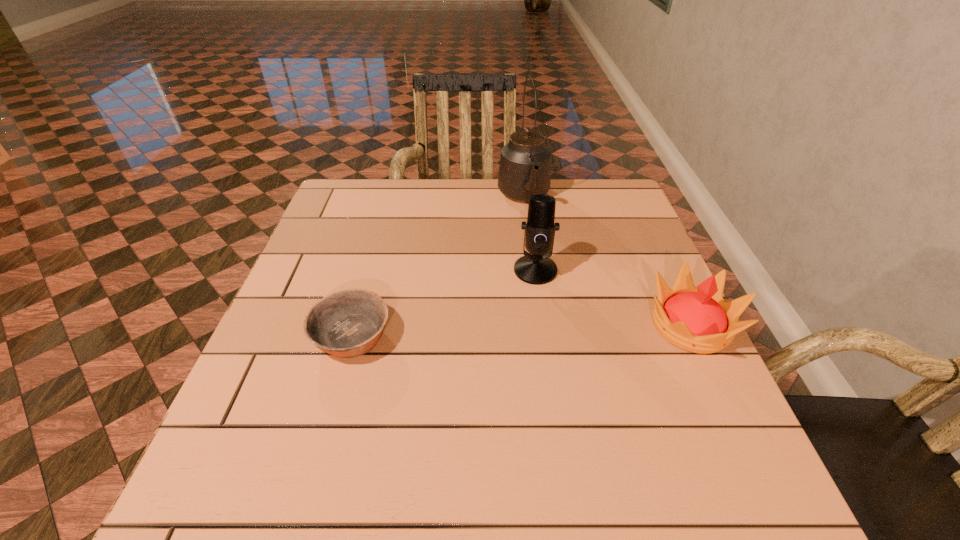
This screenshot has width=960, height=540. I want to click on free spot between the bowl and the crown, so click(x=521, y=330).

At what (x,y) coordinates should I click in order to perform the action: click on vacant area between the crown and the kettle. Please return your answer as a coordinate pair (x, y). This screenshot has height=540, width=960. Looking at the image, I should click on 608,261.

This screenshot has height=540, width=960. I want to click on unoccupied area between the shortest object and the kettle, so tap(438, 266).

Where is `vacant point located between the rightmost object and the kettle`? The image size is (960, 540). vacant point located between the rightmost object and the kettle is located at coordinates (608, 261).

Locate an element on the screen. This screenshot has width=960, height=540. empty space between the microphone and the crown is located at coordinates coord(613,298).

Identify which object is located as the second nearest to the third shortest object. Please provide its 2D coordinates. Your answer should be formatted as a tuple, i.e. [(x, y)], where the tuple contains the x and y coordinates of a point satisfying the conditions above.

[(525, 162)]

Point out which object is positioned as the second nearest to the second farthest object. Please provide its 2D coordinates. Your answer should be formatted as a tuple, i.e. [(x, y)], where the tuple contains the x and y coordinates of a point satisfying the conditions above.

[(525, 162)]

Locate an element on the screen. vacant point that satisfies the following two spatial constraints: 1. on the front side of the third nearest object; 2. on the right side of the kettle is located at coordinates (534, 270).